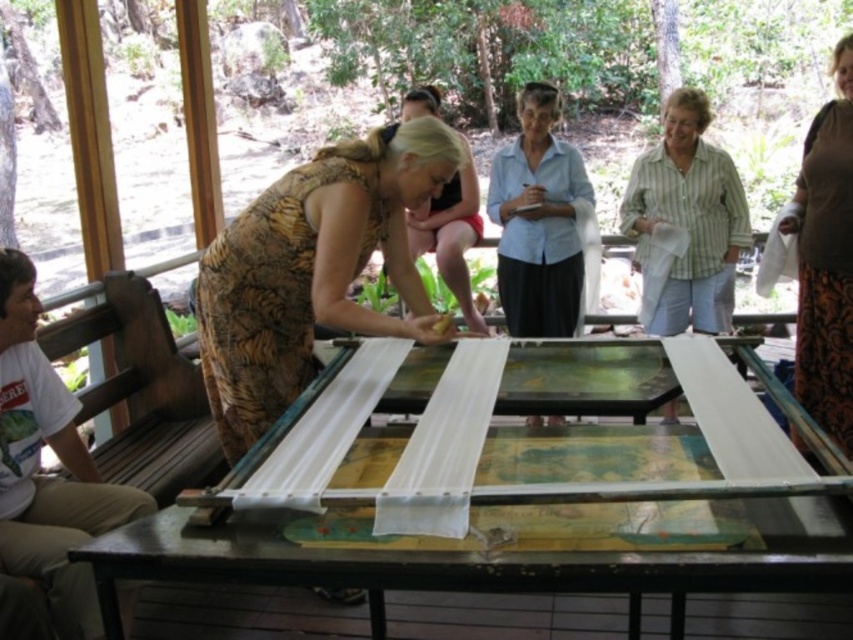
Question: Which point appears closest to the camera in this image?

Choices:
 (A) tap(842, 93)
 (B) tap(248, 310)

Answer: (B)

Question: Does brown textured dress at center appear over brown textured skirt at right?

Choices:
 (A) yes
 (B) no

Answer: (B)

Question: Is metallic silver table at center positioned in front of light blue shirt at center?

Choices:
 (A) no
 (B) yes

Answer: (B)

Question: Among these objects, which one is farthest from the camera?

Choices:
 (A) metallic silver table at center
 (B) blonde hair at center

Answer: (B)

Question: Which of these objects is positioned farthest from the brown textured skirt at right?

Choices:
 (A) blonde hair at center
 (B) green striped shirt at center

Answer: (A)

Question: Can you confirm if green striped shirt at center is bigger than light blue shirt at center?

Choices:
 (A) no
 (B) yes

Answer: (B)